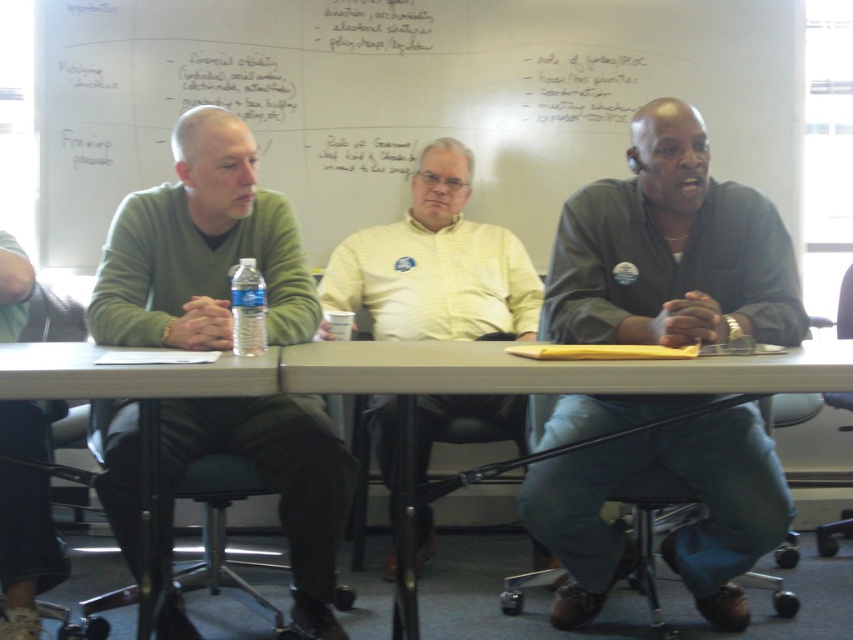
You are organizing a seating arrangement for a group photo and need to place the green sweater at left and yellow shirt at center in a row. Given their sizes, which position should the larger individual occupy to ensure stability?

The green sweater at left has a larger size compared to yellow shirt at center, so the larger individual should be placed in the middle position to provide stability and balance in the group photo arrangement.

You are a photographer standing behind the long table in the meeting room. You need to take a photo of both the green sweater at left and the yellow shirt at center so that both are fully visible. Considering their heights, which person should you position closer to the camera to ensure their full visibility?

The green sweater at left is much taller than the yellow shirt at center. To ensure both are fully visible in the photo, the yellow shirt at center should be positioned closer to the camera since the green sweater at left is taller and might block the view of the shorter person if they are both at the same distance.